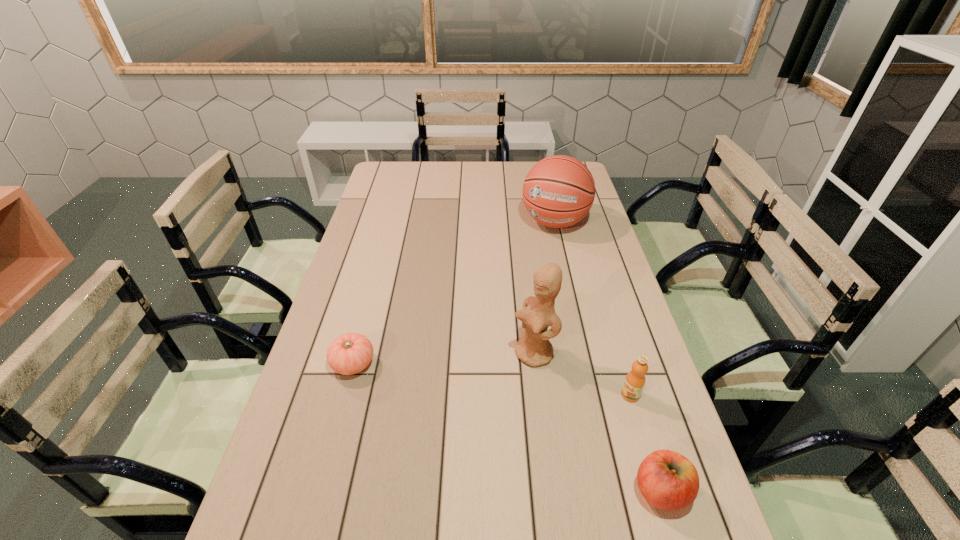
Find the location of a particular element. The height and width of the screenshot is (540, 960). object situated at the left edge is located at coordinates (350, 353).

Where is `apple that is at the right edge`? apple that is at the right edge is located at coordinates (667, 480).

Find the location of a particular element. orange juice at the right edge is located at coordinates coord(635,380).

At what (x,y) coordinates should I click in order to perform the action: click on basketball at the right edge. Please return your answer as a coordinate pair (x, y). Image resolution: width=960 pixels, height=540 pixels. Looking at the image, I should click on (558, 191).

What are the coordinates of `object that is at the near right corner` in the screenshot? It's located at (667, 480).

The image size is (960, 540). In the image, there is a desktop. Identify the location of free space at the far edge. (431, 162).

Locate an element on the screen. free point at the left edge is located at coordinates (383, 199).

Where is `vacant area at the right edge`? vacant area at the right edge is located at coordinates (616, 302).

At what (x,y) coordinates should I click in order to perform the action: click on vacant area at the far left corner of the desktop. Please return your answer as a coordinate pair (x, y). The image size is (960, 540). Looking at the image, I should click on 390,161.

The image size is (960, 540). In order to click on vacant space in between the basketball and the leftmost object in this screenshot , I will do (454, 293).